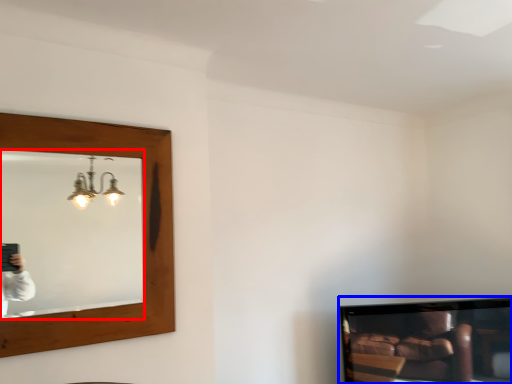
Question: Which of the following is the closest to the observer, mirror (highlighted by a red box) or television (highlighted by a blue box)?

Choices:
 (A) mirror
 (B) television

Answer: (A)